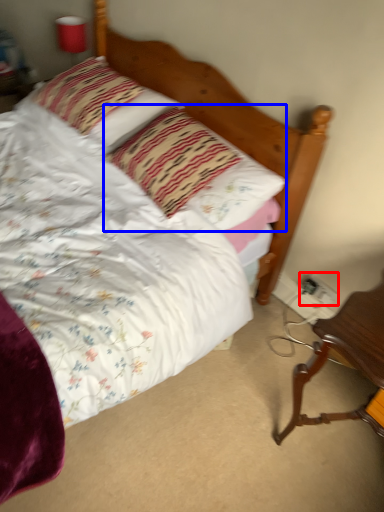
Question: Among these objects, which one is nearest to the camera, electric outlet (highlighted by a red box) or pillow (highlighted by a blue box)?

Choices:
 (A) electric outlet
 (B) pillow

Answer: (B)